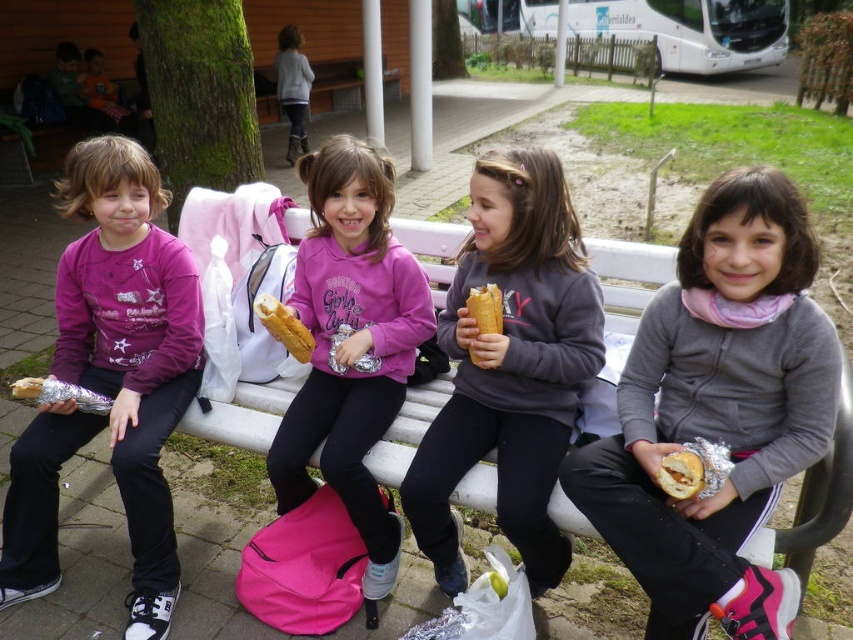
Question: Which object appears farthest from the camera in this image?

Choices:
 (A) golden brown bread at center
 (B) golden brown bread at lower right
 (C) matte gold foil at lower left
 (D) matte gray sweatshirt at center

Answer: (C)

Question: Where is golden bread at center located in relation to golden brown bread at center in the image?

Choices:
 (A) above
 (B) below

Answer: (B)

Question: Which point is farther to the camera?

Choices:
 (A) pink matte sweatshirt at center
 (B) matte gold foil at lower left

Answer: (B)

Question: Is matte purple sweatshirt at left to the right of golden brown bread at lower right from the viewer's perspective?

Choices:
 (A) yes
 (B) no

Answer: (B)

Question: Among these objects, which one is nearest to the camera?

Choices:
 (A) matte gray sweatshirt at center
 (B) pink matte sweatshirt at center
 (C) gray fleece jacket at center

Answer: (C)

Question: In this image, where is matte gray sweatshirt at center located relative to golden bread at center?

Choices:
 (A) right
 (B) left

Answer: (A)